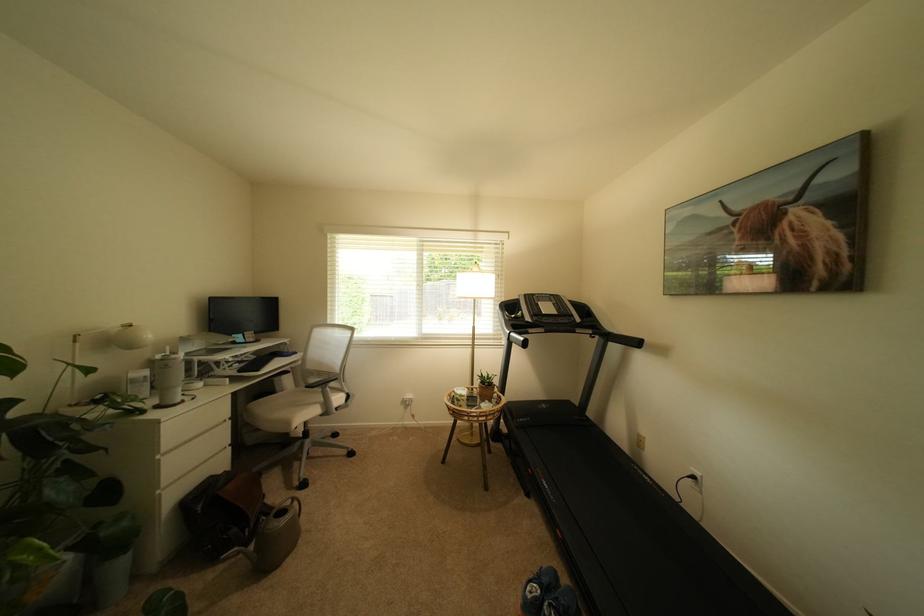
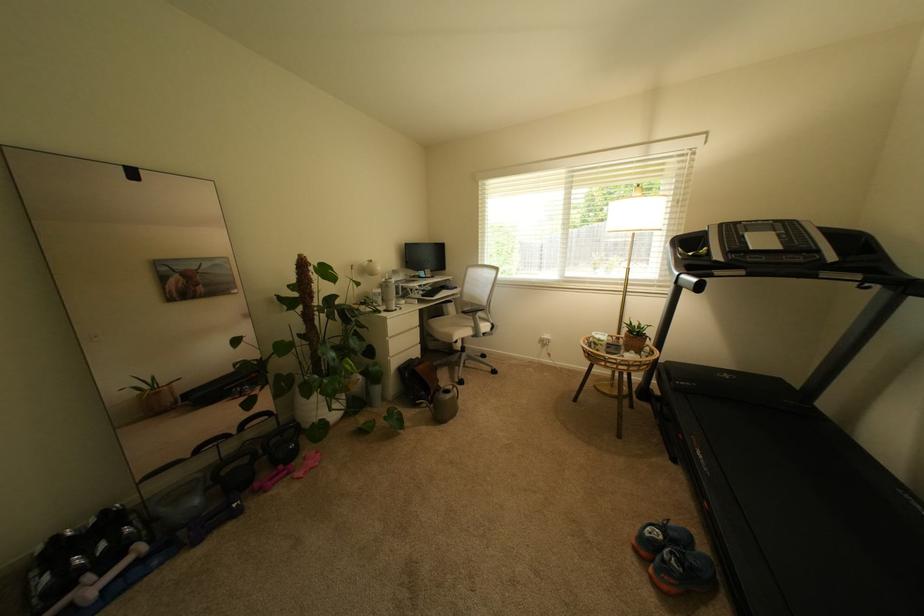
Find the pixel in the second image that matches the point at 166,458 in the first image.

(395, 339)